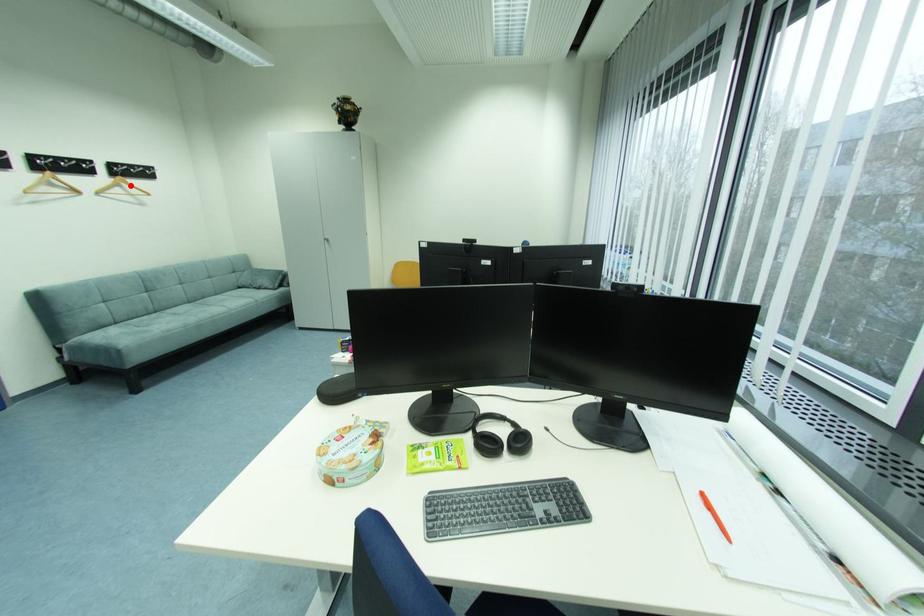
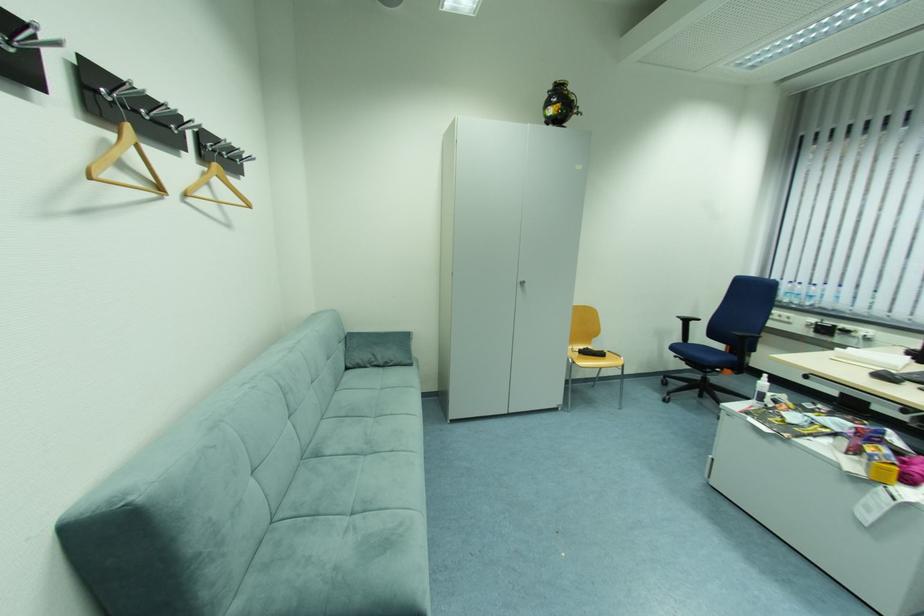
The point at the highlighted location is marked in the first image. Where is the corresponding point in the second image?

(223, 182)